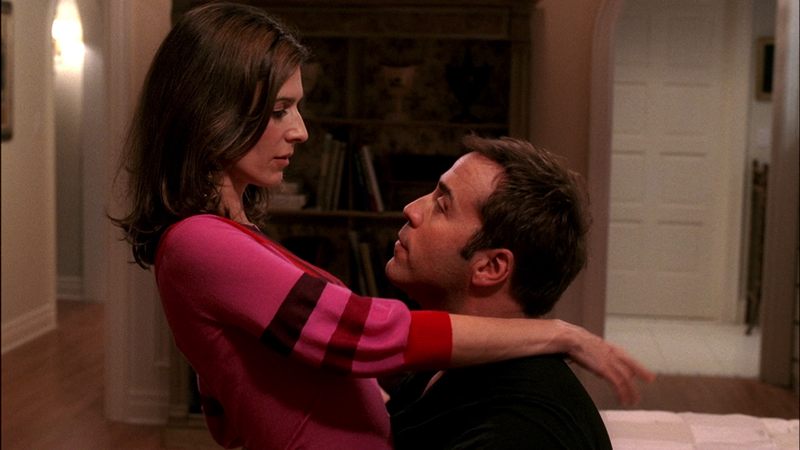
Locate an element on the screen. The height and width of the screenshot is (450, 800). floor is located at coordinates (706, 390).